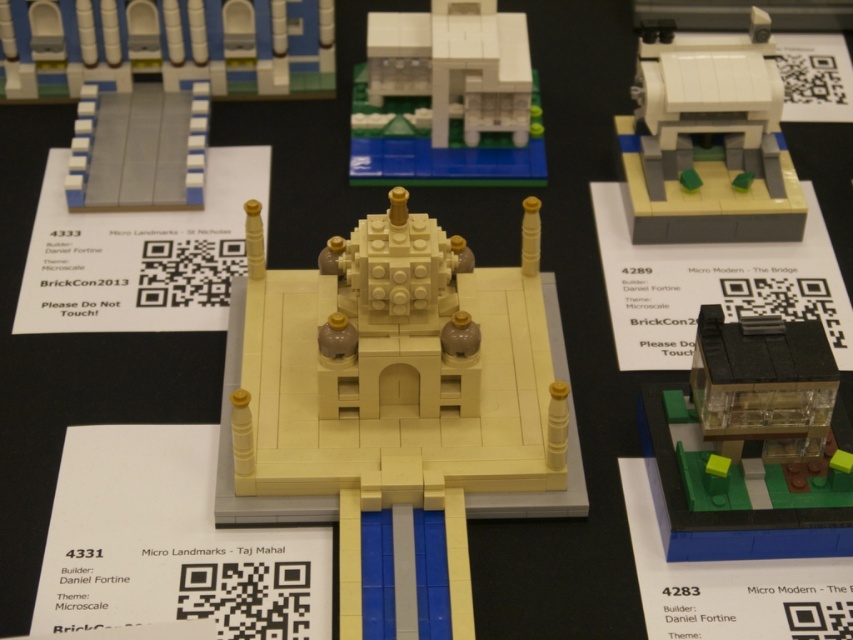
Question: Which of the following is the farthest from the observer?

Choices:
 (A) white matte building at upper center
 (B) smooth gray tiles at upper left
 (C) transparent plastic house at lower right
 (D) white matte building at upper left

Answer: (D)

Question: Is beige matte taj mahal at center wider than white matte building at upper left?

Choices:
 (A) no
 (B) yes

Answer: (A)

Question: Is white matte building at upper left bigger than smooth gray tiles at upper left?

Choices:
 (A) no
 (B) yes

Answer: (B)

Question: Among these objects, which one is farthest from the camera?

Choices:
 (A) smooth gray tiles at upper left
 (B) beige matte taj mahal at center

Answer: (A)

Question: Which point is farther from the camera taking this photo?

Choices:
 (A) (424, 548)
 (B) (753, 449)
 (C) (183, 184)
 (D) (123, 72)

Answer: (D)

Question: Can you confirm if beige matte taj mahal at center is wider than white matte building at upper left?

Choices:
 (A) yes
 (B) no

Answer: (B)